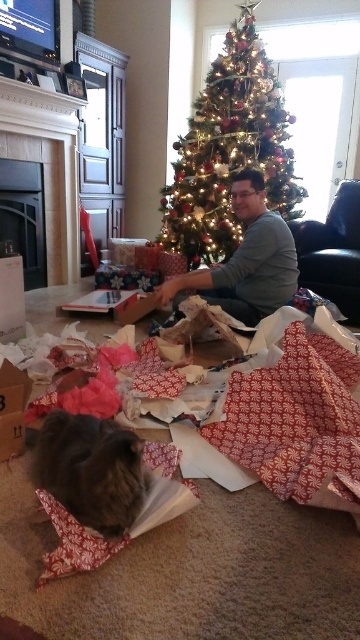
Between point (102, 452) and point (1, 400), which one is positioned in front?

Point (102, 452) is in front.

Does fluffy gray cat at lower left appear on the left side of cardboard box at lower left?

No, fluffy gray cat at lower left is not to the left of cardboard box at lower left.

You are a GUI agent. You are given a task and a screenshot of the screen. Output one action in this format:
    pyautogui.click(x=<x>, y=<y>)
    Task: Click on the fluffy gray cat at lower left
    The width and height of the screenshot is (360, 640).
    Given the screenshot: What is the action you would take?
    pyautogui.click(x=92, y=468)

Which is more to the left, fluffy gray cat at lower left or gray cotton shirt at center?

Positioned to the left is fluffy gray cat at lower left.

Can you confirm if fluffy gray cat at lower left is positioned above gray cotton shirt at center?

No.

Between point (69, 492) and point (276, 289), which one is positioned behind?

The point (276, 289) is more distant.

At what (x,y) coordinates should I click in order to perform the action: click on fluffy gray cat at lower left. Please return your answer as a coordinate pair (x, y). This screenshot has width=360, height=640. Looking at the image, I should click on (92, 468).

Where is `gray cotton shirt at center`? gray cotton shirt at center is located at coordinates (246, 260).

Measure the distance between point (263,275) and camera.

8.64 feet

You are a GUI agent. You are given a task and a screenshot of the screen. Output one action in this format:
    pyautogui.click(x=<x>, y=<y>)
    Task: Click on the gray cotton shirt at center
    The width and height of the screenshot is (360, 640).
    Given the screenshot: What is the action you would take?
    pyautogui.click(x=246, y=260)